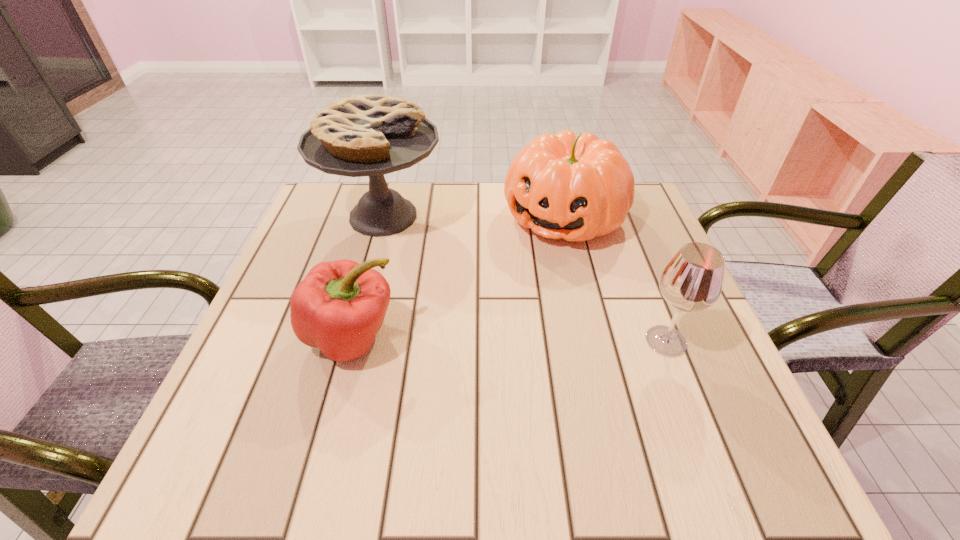
The height and width of the screenshot is (540, 960). I want to click on blank space at the far edge, so coord(407,229).

This screenshot has height=540, width=960. I want to click on free location at the near edge of the desktop, so click(x=542, y=404).

Find the location of a particular element. blank space at the left edge of the desktop is located at coordinates (258, 336).

In the image, there is a desktop. What are the coordinates of `free space at the near left corner` in the screenshot? It's located at (267, 423).

The width and height of the screenshot is (960, 540). Identify the location of blank space at the far right corner of the desktop. (630, 222).

Locate an element on the screen. This screenshot has height=540, width=960. free spot between the pie and the wineglass is located at coordinates (524, 279).

Identify the location of empty space between the wineglass and the pumpkin. (614, 279).

This screenshot has width=960, height=540. Find the location of `vacant space that's between the wineglass and the tallest object`. vacant space that's between the wineglass and the tallest object is located at coordinates (x=524, y=279).

Find the location of a particular element. free point between the wineglass and the shortest object is located at coordinates (509, 339).

Find the location of a particular element. The image size is (960, 540). object that stands as the third closest to the bell pepper is located at coordinates (692, 281).